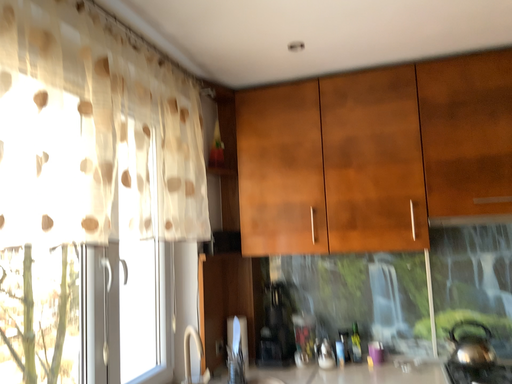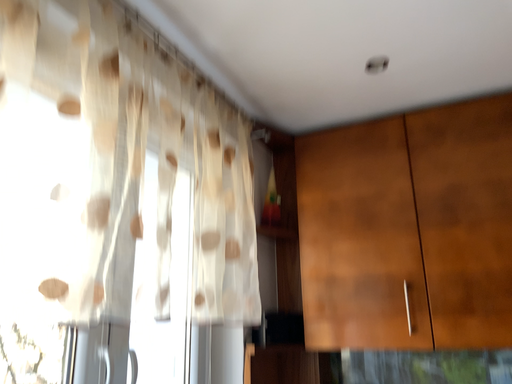
Question: Which way did the camera rotate in the video?

Choices:
 (A) rotated right
 (B) rotated left

Answer: (B)